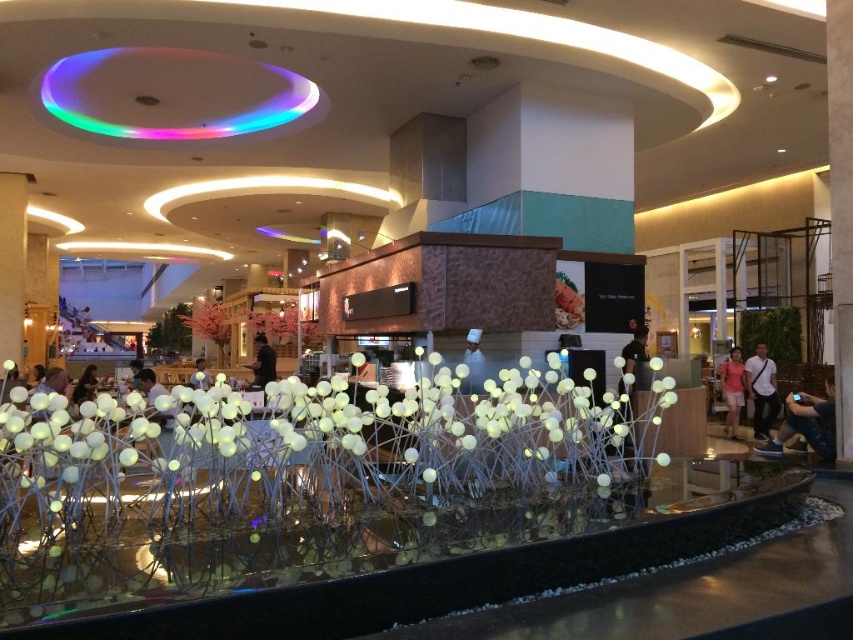
Question: Can you confirm if matte black shirt at right is positioned to the left of matte black shirt at center?

Choices:
 (A) yes
 (B) no

Answer: (B)

Question: Considering the relative positions of matte black shirt at right and black fabric person at center in the image provided, where is matte black shirt at right located with respect to black fabric person at center?

Choices:
 (A) above
 (B) below

Answer: (B)

Question: Which point is closer to the camera taking this photo?

Choices:
 (A) (831, 394)
 (B) (225, 312)
 (C) (146, 397)

Answer: (C)

Question: Does pink matte flower at center come in front of dark blue shirt at center?

Choices:
 (A) yes
 (B) no

Answer: (B)

Question: Among these objects, which one is nearest to the camera?

Choices:
 (A) matte black shirt at center
 (B) black fabric person at center
 (C) dark blue shirt at center

Answer: (A)

Question: Estimate the real-world distances between objects in this image. Which object is farther from the pink fabric dress at center?

Choices:
 (A) matte black shirt at center
 (B) dark blue shirt at center
 (C) black fabric person at center

Answer: (B)